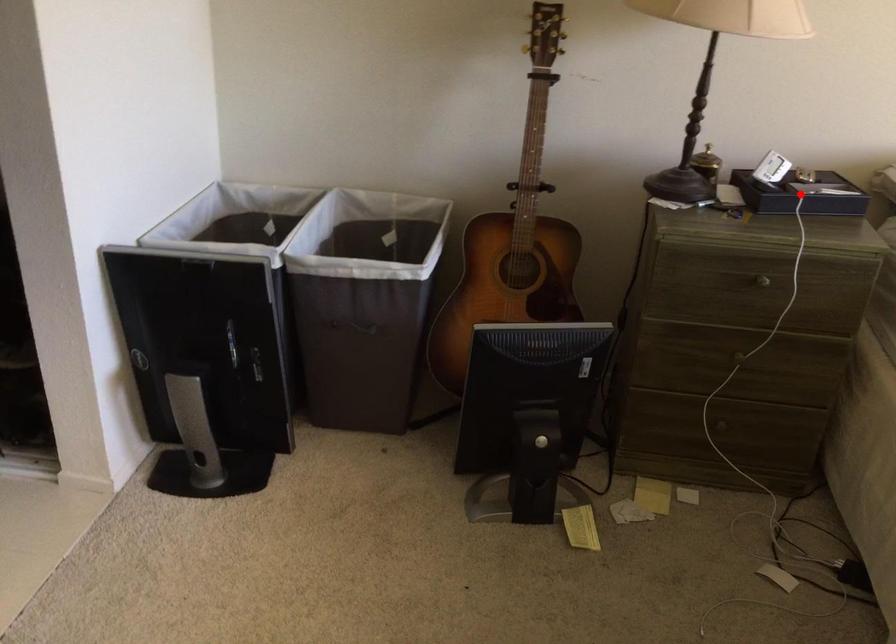
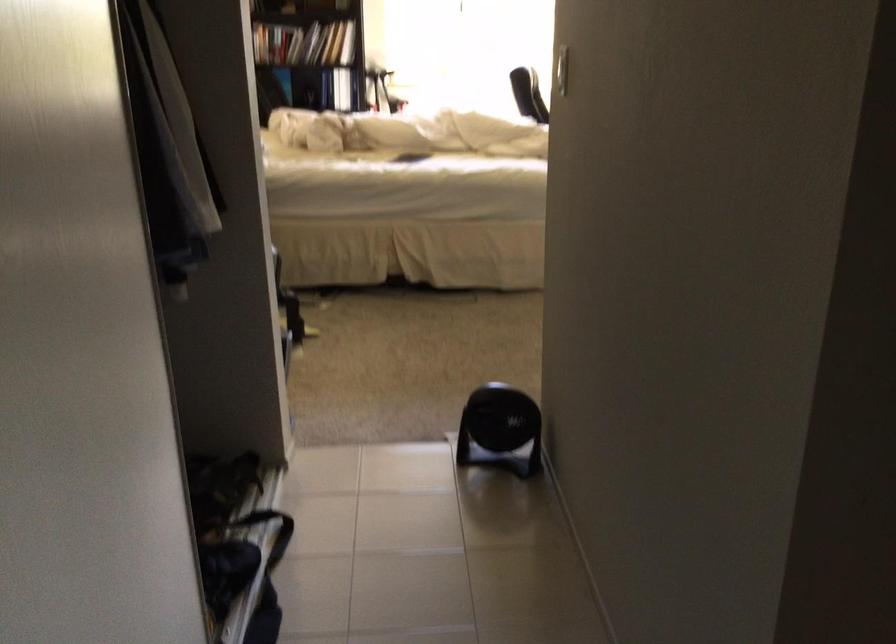
Question: I am providing you with two images of the same scene from different viewpoints. A red point is marked on the first image. Can you still see the location of the red point in image 2?

Choices:
 (A) Yes
 (B) No

Answer: (B)